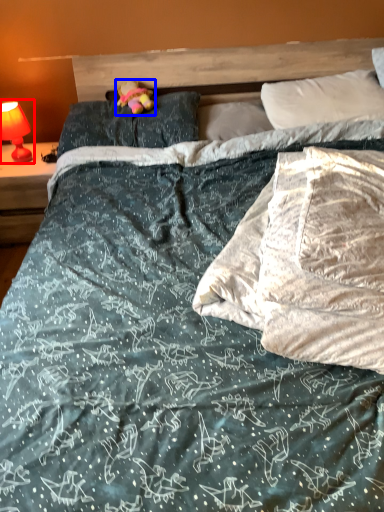
Question: Which object is further to the camera taking this photo, bedside lamp (highlighted by a red box) or figurine (highlighted by a blue box)?

Choices:
 (A) bedside lamp
 (B) figurine

Answer: (A)